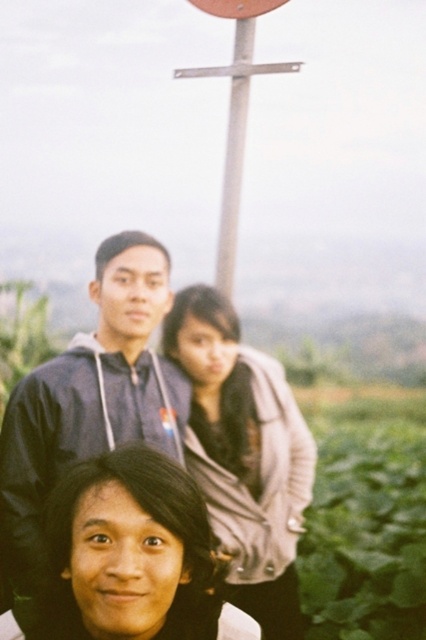
Between metallic pole at center and brushed metal sign at upper center, which one is positioned lower?

metallic pole at center is lower down.

Is metallic pole at center above brushed metal sign at upper center?

No, metallic pole at center is not above brushed metal sign at upper center.

Identify the location of metallic pole at center. (235, 152).

Which is in front, point (118, 289) or point (204, 8)?

Point (118, 289)

Is point (100, 444) positioned in front of point (201, 6)?

That is True.

The image size is (426, 640). Find the location of `dark blue hoodie at upper center`. dark blue hoodie at upper center is located at coordinates (88, 408).

Can you confirm if light brown leather jacket at center is shorter than brushed metal sign at upper center?

In fact, light brown leather jacket at center may be taller than brushed metal sign at upper center.

Can you confirm if light brown leather jacket at center is taller than brushed metal sign at upper center?

Correct, light brown leather jacket at center is much taller as brushed metal sign at upper center.

Locate an element on the screen. light brown leather jacket at center is located at coordinates (244, 454).